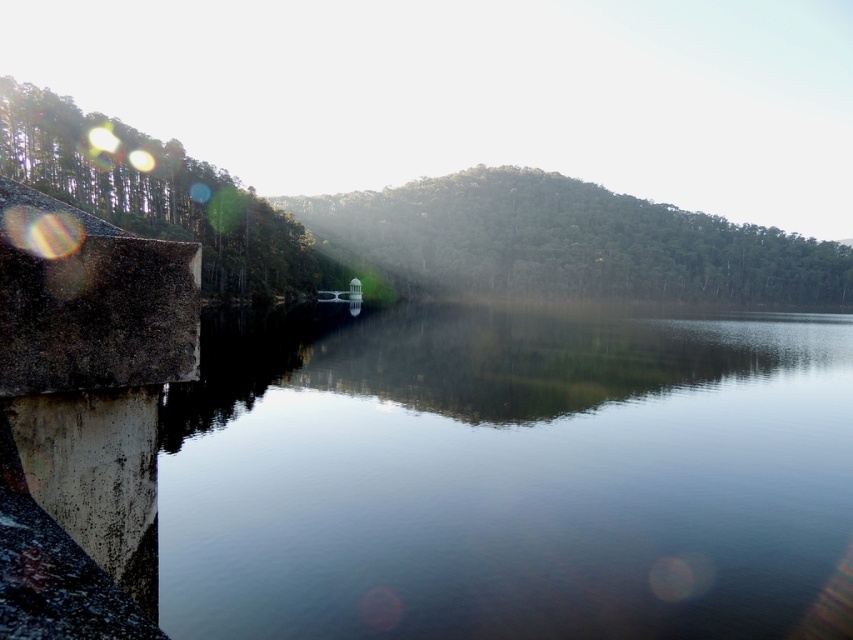
Question: Does clear water at center appear over green matte trees at left?

Choices:
 (A) yes
 (B) no

Answer: (B)

Question: Can you confirm if clear water at center is positioned below green textured hillside at center?

Choices:
 (A) yes
 (B) no

Answer: (A)

Question: Which point is closer to the camera?

Choices:
 (A) [306, 275]
 (B) [503, 288]

Answer: (A)

Question: In this image, where is clear water at center located relative to green textured hillside at center?

Choices:
 (A) left
 (B) right

Answer: (A)

Question: Among these points, which one is nearest to the camera?

Choices:
 (A) (519, 321)
 (B) (314, 282)

Answer: (A)

Question: Which of the following is the closest to the observer?

Choices:
 (A) green matte trees at left
 (B) green textured hillside at center
 (C) clear water at center

Answer: (C)